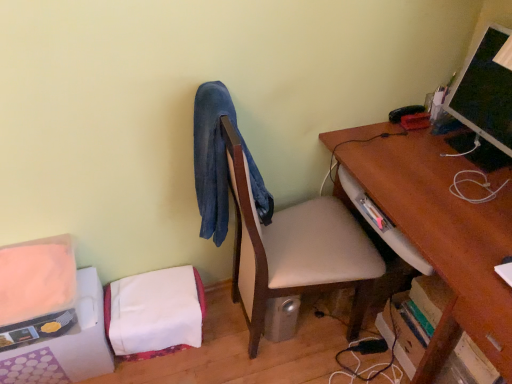
Question: Is white fabric at lower left positioned before matte black monitor at upper right?

Choices:
 (A) yes
 (B) no

Answer: (B)

Question: Is white fabric at lower left facing away from matte black monitor at upper right?

Choices:
 (A) no
 (B) yes

Answer: (A)

Question: Is white fabric at lower left beside matte black monitor at upper right?

Choices:
 (A) yes
 (B) no

Answer: (B)

Question: Is white fabric at lower left smaller than matte black monitor at upper right?

Choices:
 (A) yes
 (B) no

Answer: (B)

Question: Does white fabric at lower left have a larger size compared to matte black monitor at upper right?

Choices:
 (A) yes
 (B) no

Answer: (A)

Question: From the image's perspective, is white fabric at lower left on top of matte black monitor at upper right?

Choices:
 (A) yes
 (B) no

Answer: (B)

Question: Does matte black monitor at upper right appear on the right side of wooden desk at center-right?

Choices:
 (A) yes
 (B) no

Answer: (A)

Question: Would you say matte black monitor at upper right is a long distance from wooden desk at center-right?

Choices:
 (A) yes
 (B) no

Answer: (B)

Question: Is matte black monitor at upper right shorter than wooden desk at center-right?

Choices:
 (A) yes
 (B) no

Answer: (A)

Question: Does matte black monitor at upper right have a smaller size compared to wooden desk at center-right?

Choices:
 (A) no
 (B) yes

Answer: (B)

Question: From a real-world perspective, does matte black monitor at upper right sit lower than wooden desk at center-right?

Choices:
 (A) no
 (B) yes

Answer: (A)

Question: Can you confirm if matte black monitor at upper right is thinner than wooden desk at center-right?

Choices:
 (A) yes
 (B) no

Answer: (A)

Question: From a real-world perspective, is wooden desk at center-right under matte black monitor at upper right?

Choices:
 (A) yes
 (B) no

Answer: (A)